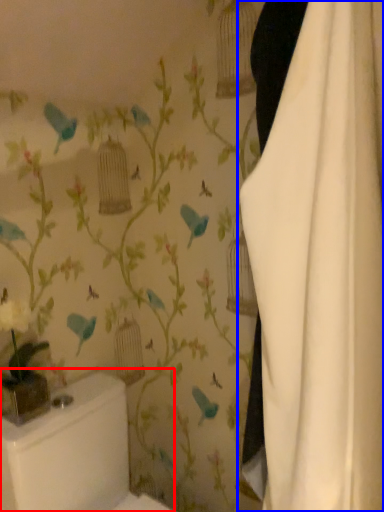
Question: Which of the following is the farthest to the observer, toilet bowl (highlighted by a red box) or curtain (highlighted by a blue box)?

Choices:
 (A) toilet bowl
 (B) curtain

Answer: (A)